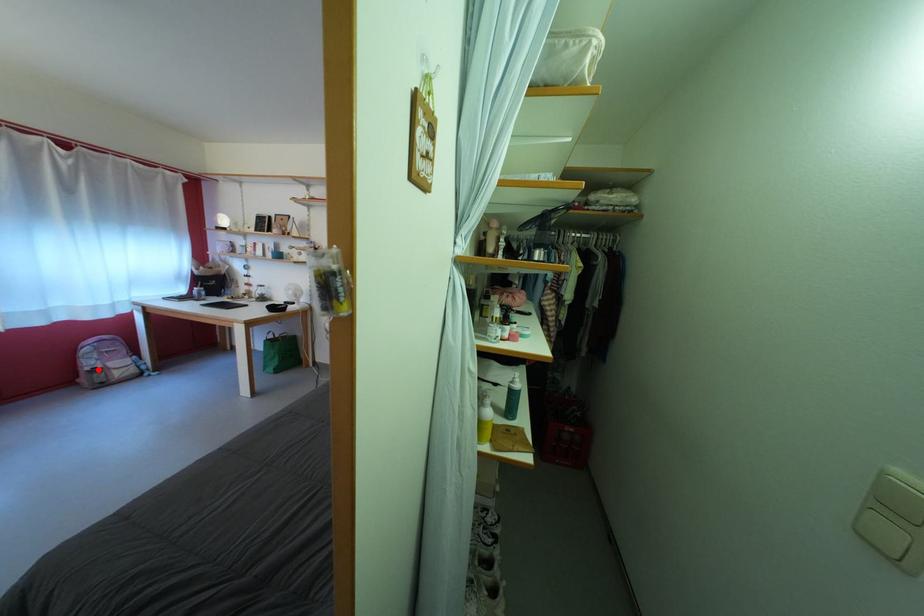
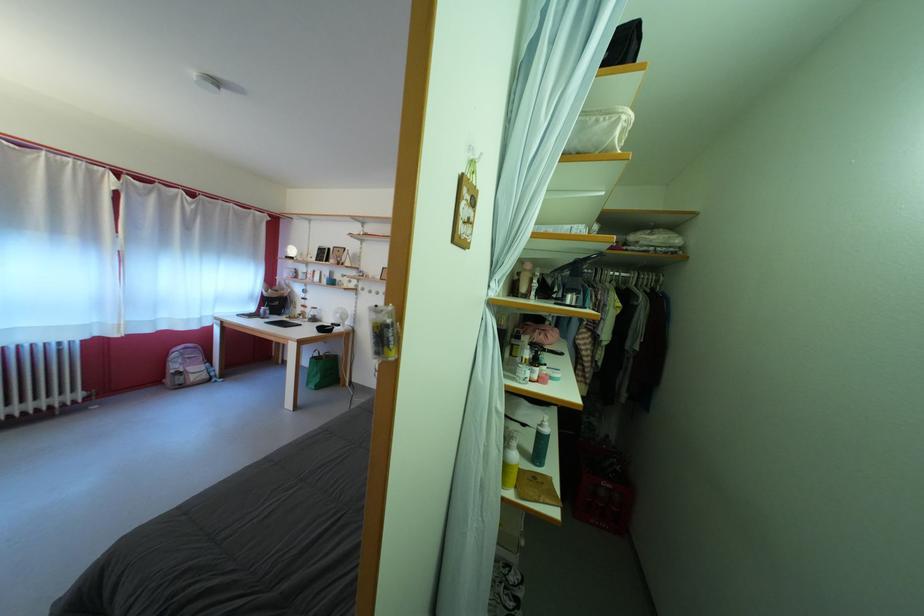
In the second image, find the point that corresponds to the highlighted location in the first image.

(184, 373)